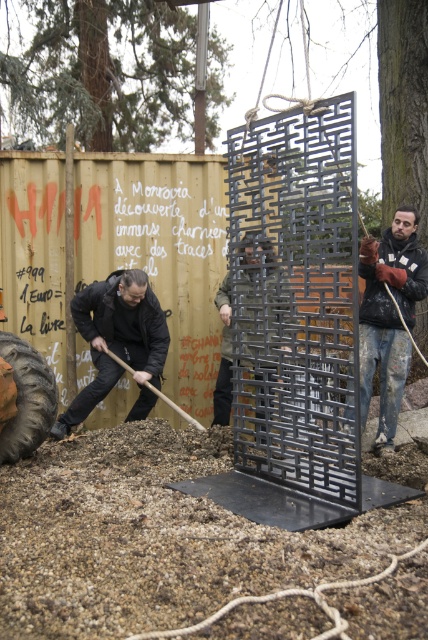
You are a worker in the construction area shown. You need to move the smooth wooden shovel at lower center to the left. Will moving it left bring it closer to the metallic grid at center?

The metallic grid at center is to the right of the smooth wooden shovel at lower center. Moving the shovel to the left would take it further away from the metallic grid at center.

You are a photographer trying to capture the two points in the image. Which point, point [23,353] or point [151,388], will appear larger in your photo?

Point [23,353] is closer to the camera than point [151,388], so it will appear larger in the photo.

You are a worker in the scene and need to retrieve an item from the metallic grid at center. The black matte jacket at lower left is in your way. Can you move the jacket to access the grid?

The black matte jacket at lower left is positioned under the metallic grid at center, so moving the jacket would allow access to the grid.